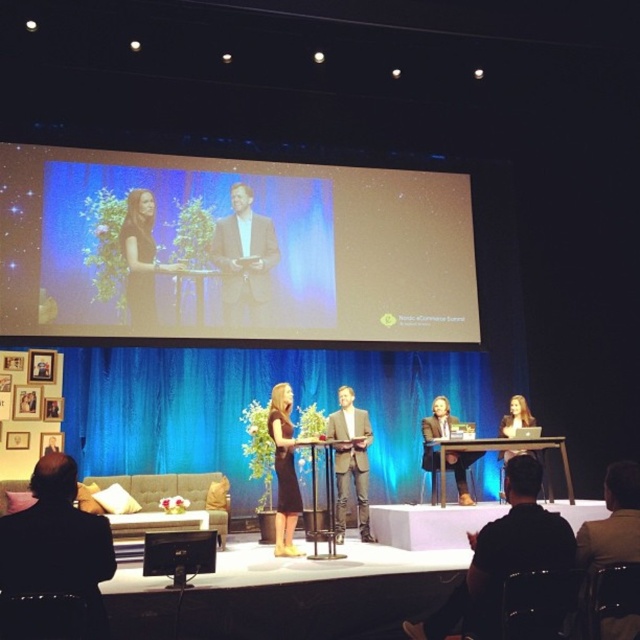
Question: Is black satin dress at center above matte black laptop at lower right?

Choices:
 (A) yes
 (B) no

Answer: (A)

Question: Among these objects, which one is nearest to the camera?

Choices:
 (A) brown leather jacket at lower right
 (B) white glossy podium at lower center
 (C) light brown leather suit at center

Answer: (A)

Question: Which point is farther to the camera?

Choices:
 (A) matte black laptop at lower right
 (B) brown leather jacket at lower right
 (C) black satin dress at center

Answer: (A)

Question: From the image, what is the correct spatial relationship of black leather jacket at lower right in relation to matte black monitor at lower left?

Choices:
 (A) below
 (B) above

Answer: (B)

Question: Observing the image, what is the correct spatial positioning of light brown leather suit at center in reference to metallic silver podium at center?

Choices:
 (A) above
 (B) below

Answer: (A)

Question: Which object is positioned farthest from the light brown leather suit at center?

Choices:
 (A) black leather jacket at lower left
 (B) blue velvet curtain at center
 (C) matte black podium at center
 (D) black satin dress at center

Answer: (A)